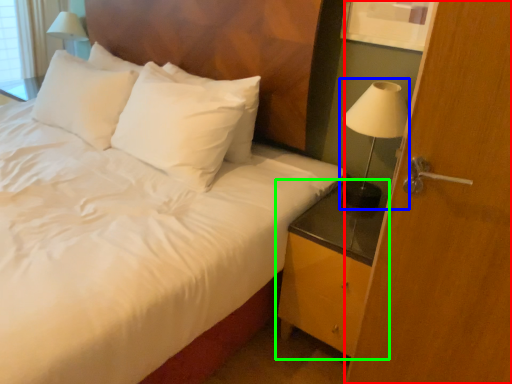
Question: Estimate the real-world distances between objects in this image. Which object is closer to screen door (highlighted by a red box), bedside lamp (highlighted by a blue box) or nightstand (highlighted by a green box)?

Choices:
 (A) bedside lamp
 (B) nightstand

Answer: (B)